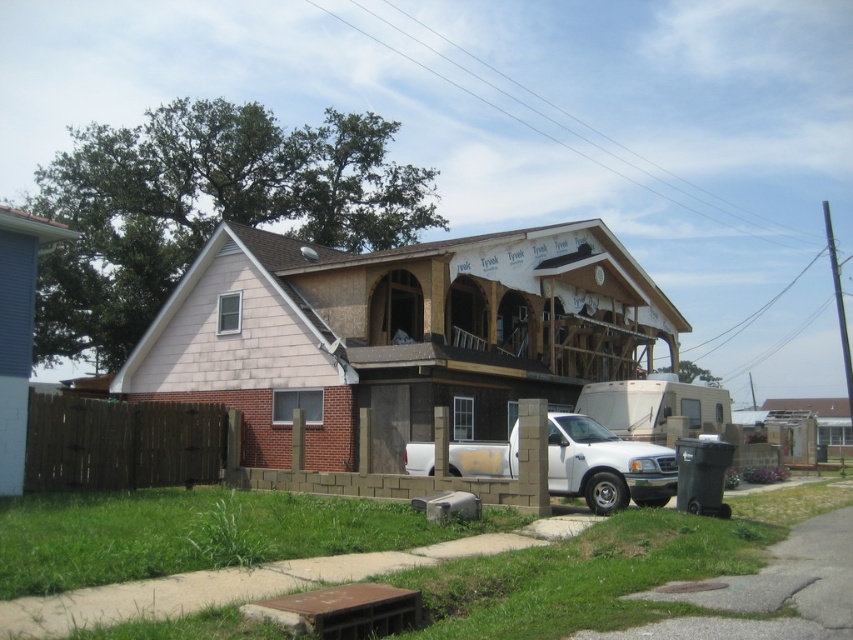
Measure the distance from wooden frame house at center to white matte truck at center.

wooden frame house at center and white matte truck at center are 9.73 meters apart.

Does point (347, 451) come in front of point (664, 470)?

No, it is not.

You are a GUI agent. You are given a task and a screenshot of the screen. Output one action in this format:
    pyautogui.click(x=<x>, y=<y>)
    Task: Click on the wooden frame house at center
    This screenshot has height=640, width=853.
    Given the screenshot: What is the action you would take?
    pyautogui.click(x=397, y=333)